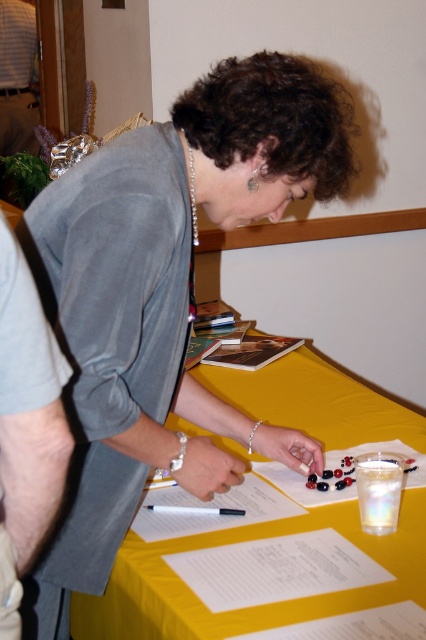
Is gray fabric shirt at left to the right of brushed metal water at bottle left from the viewer's perspective?

Indeed, gray fabric shirt at left is positioned on the right side of brushed metal water at bottle left.

Based on the photo, which is below, gray fabric shirt at left or brushed metal water at bottle left?

gray fabric shirt at left is below.

Locate an element on the screen. This screenshot has width=426, height=640. gray fabric shirt at left is located at coordinates (28, 404).

Is point (144, 557) closer to camera compared to point (201, 508)?

Yes, point (144, 557) is in front of point (201, 508).

Who is more forward, (78, 625) or (222, 515)?

Positioned in front is point (222, 515).

Who is more forward, (357, 529) or (215, 509)?

Point (357, 529)

Identify the location of yellow fabric table at center. The height and width of the screenshot is (640, 426). (253, 608).

Which is below, yellow fabric table at center or white paper at center?

white paper at center

Does yellow fabric table at center appear over white paper at center?

Indeed, yellow fabric table at center is positioned over white paper at center.

Between point (71, 612) and point (359, 452), which one is positioned in front?

Positioned in front is point (71, 612).

Where is `yellow fabric table at center`? The height and width of the screenshot is (640, 426). yellow fabric table at center is located at coordinates (253, 608).